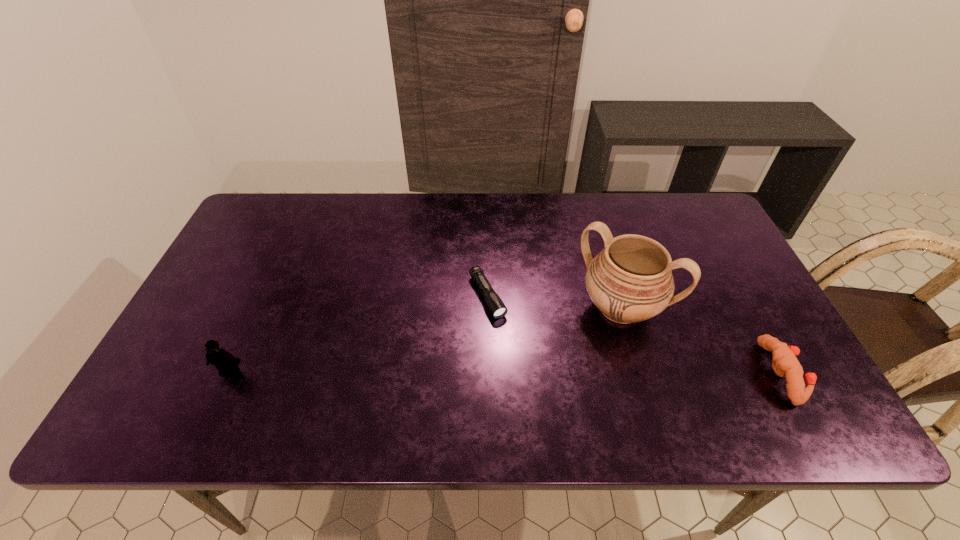
In the image, there is a desktop. Where is `vacant space at the far edge`? vacant space at the far edge is located at coordinates (614, 232).

The width and height of the screenshot is (960, 540). Find the location of `vacant space at the near edge of the desktop`. vacant space at the near edge of the desktop is located at coordinates (454, 368).

This screenshot has height=540, width=960. Find the location of `vacant space at the left edge of the desktop`. vacant space at the left edge of the desktop is located at coordinates (230, 290).

This screenshot has width=960, height=540. In the image, there is a desktop. Find the location of `free space at the far left corner`. free space at the far left corner is located at coordinates (278, 194).

You are a GUI agent. You are given a task and a screenshot of the screen. Output one action in this format:
    pyautogui.click(x=<x>, y=<y>)
    Task: Click on the vacant space that is in between the Lego and the tallest object
    This screenshot has width=960, height=540.
    Given the screenshot: What is the action you would take?
    pyautogui.click(x=425, y=340)

The image size is (960, 540). What are the coordinates of `vacant area between the tallest object and the second shortest object` in the screenshot? It's located at (701, 341).

Find the location of `free space between the third shortest object and the urn`. free space between the third shortest object and the urn is located at coordinates (425, 340).

You are a GUI agent. You are given a task and a screenshot of the screen. Output one action in this format:
    pyautogui.click(x=<x>, y=<y>)
    Task: Click on the free space between the rightmost object and the third object from left to right
    The height and width of the screenshot is (540, 960).
    Given the screenshot: What is the action you would take?
    pyautogui.click(x=701, y=341)

Where is `vacant area between the third object from right to left and the leftmost object`? vacant area between the third object from right to left and the leftmost object is located at coordinates point(359,334).

Find the location of a particular element. Image resolution: width=960 pixels, height=540 pixels. vacant space that is in between the third object from left to right and the leftmost object is located at coordinates (425, 340).